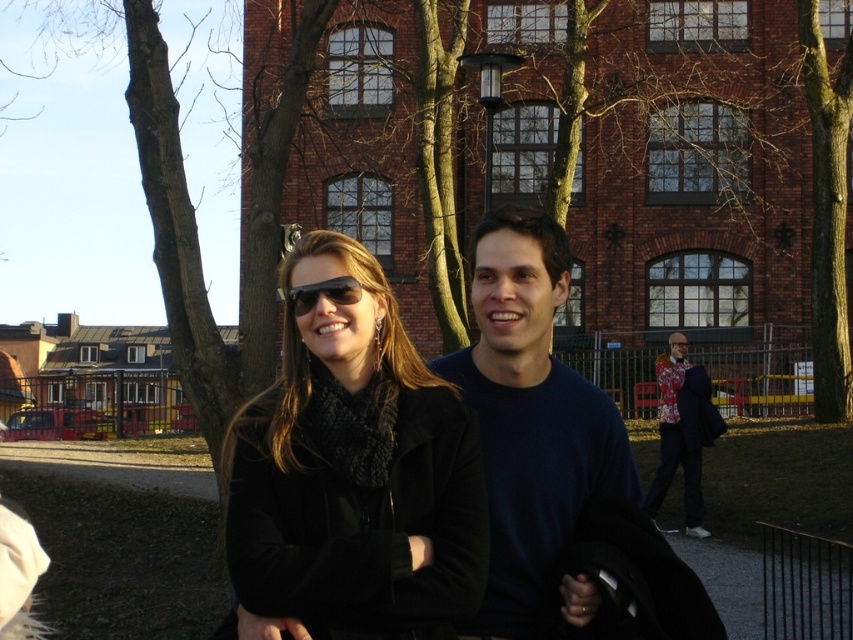
Question: Which object appears farthest from the camera in this image?

Choices:
 (A) matte black sunglasses at center
 (B) black matte jacket at center

Answer: (A)

Question: Which object appears closest to the camera in this image?

Choices:
 (A) black matte jacket at center
 (B) floral fabric jacket at lower right
 (C) matte black sunglasses at center

Answer: (A)

Question: Is dark blue sweater at center to the right of floral fabric jacket at lower right from the viewer's perspective?

Choices:
 (A) yes
 (B) no

Answer: (B)

Question: Which point is farther from the camera taking this photo?

Choices:
 (A) (399, 356)
 (B) (685, 477)
 (C) (334, 282)
 (D) (502, 609)

Answer: (B)

Question: Is black matte jacket at center wider than matte black sunglasses at center?

Choices:
 (A) no
 (B) yes

Answer: (B)

Question: In this image, where is dark blue sweater at center located relative to floral fabric jacket at lower right?

Choices:
 (A) right
 (B) left

Answer: (B)